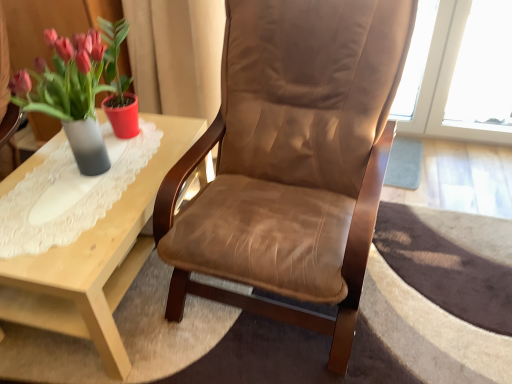
Where is `empty space that is ontop of light wood coffee table at left (from a real-world perspective)`? This screenshot has width=512, height=384. empty space that is ontop of light wood coffee table at left (from a real-world perspective) is located at coordinates (87, 182).